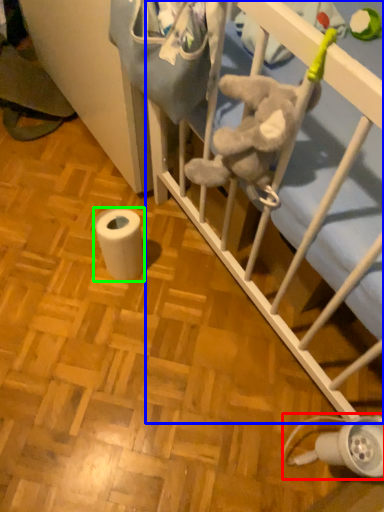
Question: Estimate the real-world distances between objects in this image. Which object is closer to lamp (highlighted by a red box), infant bed (highlighted by a blue box) or toilet paper (highlighted by a green box)?

Choices:
 (A) infant bed
 (B) toilet paper

Answer: (A)